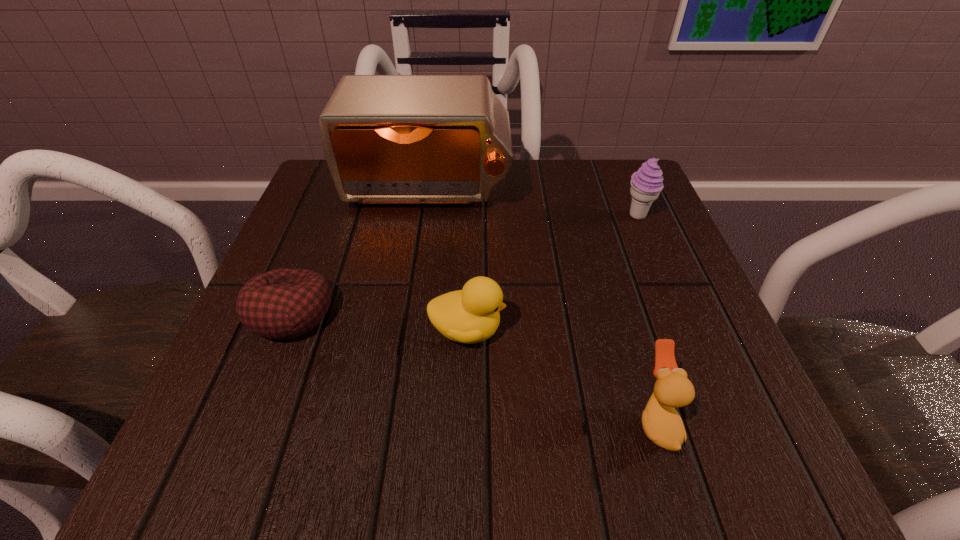
Identify the location of blank space at the near right corner of the desktop. (718, 449).

Where is `free spot between the left duck and the shortest object`? free spot between the left duck and the shortest object is located at coordinates (379, 322).

You are a GUI agent. You are given a task and a screenshot of the screen. Output one action in this format:
    pyautogui.click(x=<x>, y=<y>)
    Task: Click on the empty space between the shortest object and the toaster oven
    This screenshot has width=960, height=540.
    Given the screenshot: What is the action you would take?
    pyautogui.click(x=360, y=251)

Locate an element on the screen. The width and height of the screenshot is (960, 540). blank region between the shortest object and the nearer duck is located at coordinates (473, 367).

This screenshot has width=960, height=540. I want to click on free space between the left duck and the second tallest object, so click(552, 273).

This screenshot has height=540, width=960. Find the location of `vacant area that lies between the nearer duck and the icecream`. vacant area that lies between the nearer duck and the icecream is located at coordinates (647, 318).

Locate an element on the screen. This screenshot has width=960, height=540. vacant area that lies between the right duck and the farther duck is located at coordinates (562, 375).

At what (x,y) coordinates should I click in order to perform the action: click on free space between the beanbag and the left duck. Please return your answer as a coordinate pair (x, y). This screenshot has width=960, height=540. Looking at the image, I should click on (379, 322).

Where is `free point between the beanbag and the fourth shortest object`? This screenshot has height=540, width=960. free point between the beanbag and the fourth shortest object is located at coordinates (465, 265).

Locate an element on the screen. The image size is (960, 540). vacant space in between the rightmost object and the farther duck is located at coordinates (552, 273).